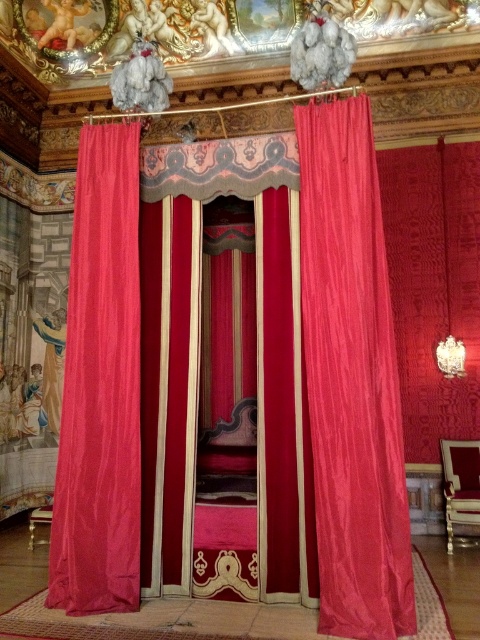
Question: Which of these objects is positioned closest to the silky pink curtain at left?

Choices:
 (A) velvet bed at center
 (B) velvet pink curtain at center

Answer: (A)

Question: Does velvet pink curtain at center have a larger size compared to silky pink curtain at left?

Choices:
 (A) no
 (B) yes

Answer: (B)

Question: Among these points, which one is farthest from the camera?

Choices:
 (A) (400, 518)
 (B) (144, 307)

Answer: (B)

Question: Can you confirm if velvet pink curtain at center is positioned to the right of silky pink curtain at left?

Choices:
 (A) no
 (B) yes

Answer: (B)

Question: Which object is positioned farthest from the velvet pink curtain at center?

Choices:
 (A) silky pink curtain at left
 (B) velvet bed at center

Answer: (A)

Question: Considering the relative positions of velvet pink curtain at center and silky pink curtain at left in the image provided, where is velvet pink curtain at center located with respect to silky pink curtain at left?

Choices:
 (A) left
 (B) right

Answer: (B)